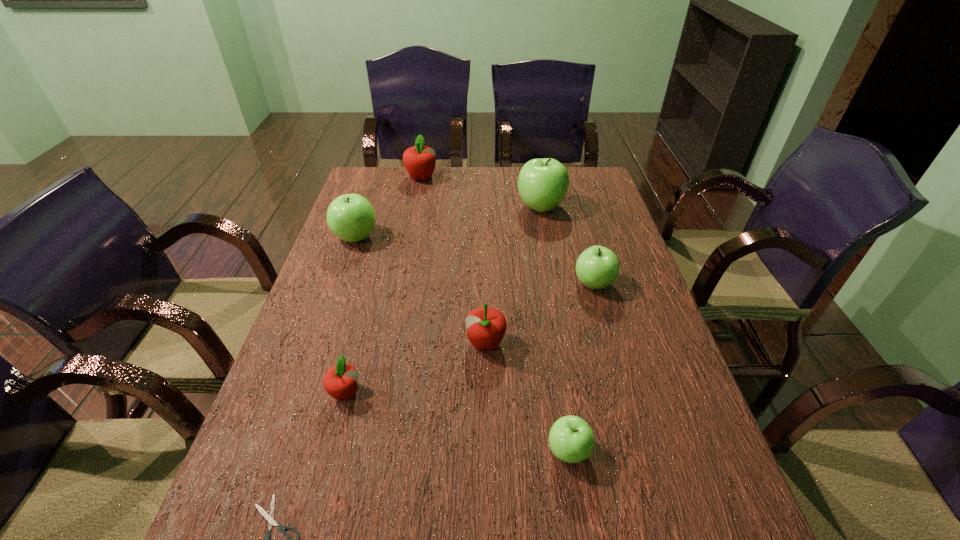
Point out which red apple is positioned as the nearest to the fifth object from left to right. Please provide its 2D coordinates. Your answer should be formatted as a tuple, i.e. [(x, y)], where the tuple contains the x and y coordinates of a point satisfying the conditions above.

[(340, 381)]

Locate which red apple ranks in proximity to the second nearest red apple. Please provide its 2D coordinates. Your answer should be formatted as a tuple, i.e. [(x, y)], where the tuple contains the x and y coordinates of a point satisfying the conditions above.

[(340, 381)]